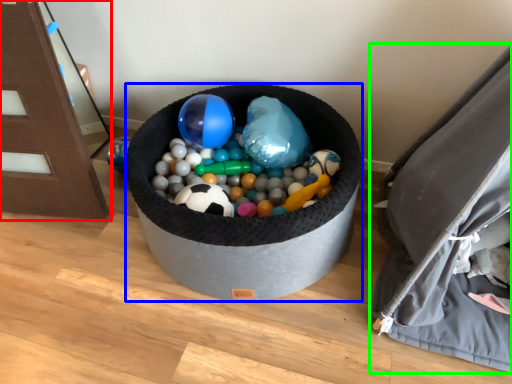
Question: Based on their relative distances, which object is farther from furniture (highlighted by a red box)? Choose from toy (highlighted by a blue box) and bean bag chair (highlighted by a green box).

Choices:
 (A) toy
 (B) bean bag chair

Answer: (B)